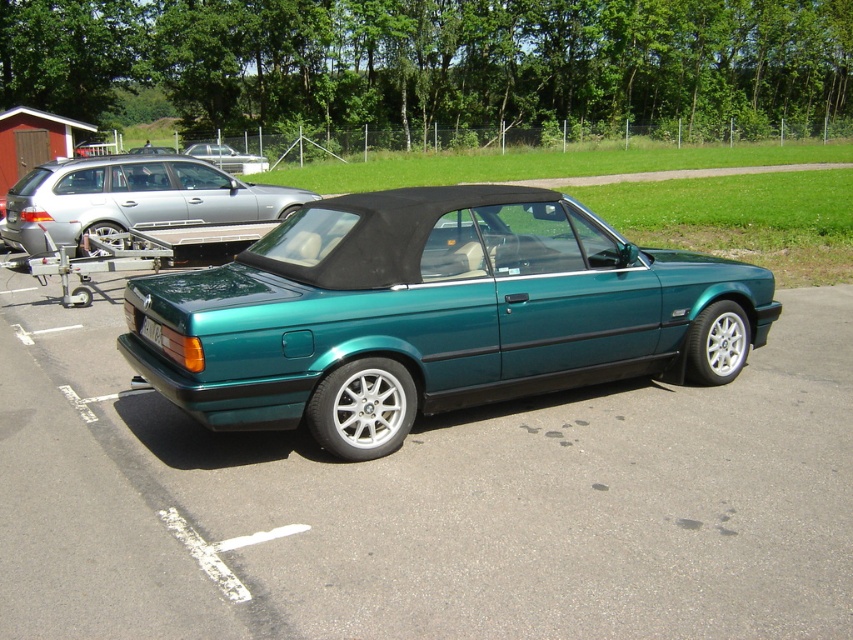
Question: Which point is farther to the camera?

Choices:
 (A) (62, 186)
 (B) (672, 476)
 (C) (155, 340)
 (D) (175, 372)

Answer: (A)

Question: From the image, what is the correct spatial relationship of metallic teal car at center in relation to green matte license plate at lower center?

Choices:
 (A) right
 (B) left

Answer: (A)

Question: Estimate the real-world distances between objects in this image. Which object is closer to the metallic teal car at center?

Choices:
 (A) satin silver metallic station wagon at upper left
 (B) green matte license plate at lower center

Answer: (B)

Question: Does teal metallic convertible at center have a larger size compared to teal metallic car at center?

Choices:
 (A) yes
 (B) no

Answer: (B)

Question: Which point appears closest to the camera in this image?

Choices:
 (A) (595, 582)
 (B) (532, 253)

Answer: (A)

Question: Is teal metallic convertible at center positioned before green matte license plate at lower center?

Choices:
 (A) yes
 (B) no

Answer: (A)